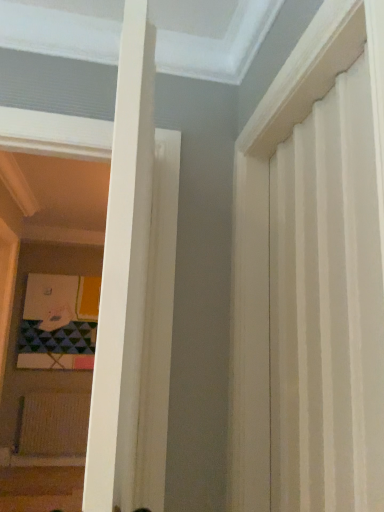
Find the location of a particular element. Image resolution: width=384 pixels, height=512 pixels. white textured curtain at upper right is located at coordinates (268, 218).

Describe the element at coordinates (268, 218) in the screenshot. I see `white textured curtain at upper right` at that location.

The image size is (384, 512). I want to click on white textured curtain at upper right, so click(268, 218).